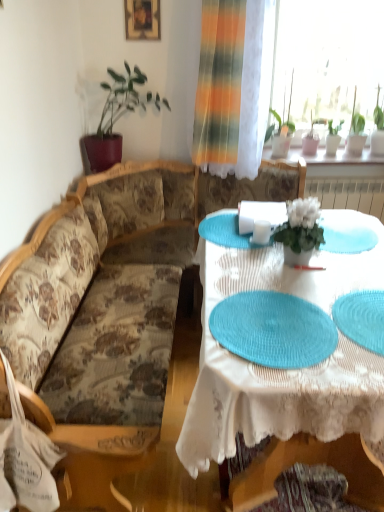
What do you see at coordinates (356, 131) in the screenshot? I see `green leafy plant at upper right, which is the 1th houseplant from right to left` at bounding box center [356, 131].

Locate an element on the screen. This screenshot has width=384, height=512. green leafy plant at upper right, which is the 5th houseplant from left to right is located at coordinates (356, 131).

I want to click on wooden picture frame at upper center, so click(142, 19).

What do you see at coordinates (362, 318) in the screenshot?
I see `blue woven placemat at lower right` at bounding box center [362, 318].

This screenshot has height=512, width=384. I want to click on blue woven placemat at lower right, so click(x=362, y=318).

This screenshot has height=512, width=384. What do you see at coordinates (300, 232) in the screenshot?
I see `white matte flower pot at center, the fourth houseplant positioned from the right` at bounding box center [300, 232].

What is the approximate height of white matte flower pot at center, placed as the first houseplant when sorted from front to back?

The height of white matte flower pot at center, placed as the first houseplant when sorted from front to back, is 10.23 inches.

The width and height of the screenshot is (384, 512). In order to click on teal woven placemat at center in this screenshot , I will do `click(273, 329)`.

Considering the sizes of green matte plant at upper right, arranged as the first houseplant when viewed from the back, and green leafy plant at upper right, which is the 5th houseplant from left to right, in the image, is green matte plant at upper right, arranged as the first houseplant when viewed from the back, bigger or smaller than green leafy plant at upper right, which is the 5th houseplant from left to right,?

In the image, green matte plant at upper right, arranged as the first houseplant when viewed from the back, appears to be smaller than green leafy plant at upper right, which is the 5th houseplant from left to right.

Is green leafy plant at upper right, the second houseplant when ordered from back to front, at the back of green matte plant at upper right, the fourth houseplant viewed from the left?

No.

Which is more to the right, green matte plant at upper right, which appears as the fifth houseplant when viewed from the front, or green leafy plant at upper right, which is the 5th houseplant from left to right?

green leafy plant at upper right, which is the 5th houseplant from left to right, is more to the right.

From a real-world perspective, which is physically below, green matte plant at upper right, the fourth houseplant viewed from the left, or green leafy plant at upper right, which is the 5th houseplant from left to right?

From a 3D spatial view, green matte plant at upper right, the fourth houseplant viewed from the left, is below.

Is green leafy plant at upper right, the 3th houseplant viewed from the right, positioned in front of teal woven placemat at center?

No, green leafy plant at upper right, the 3th houseplant viewed from the right, is further to the viewer.

Locate an element on the screen. the 4th houseplant directly above the teal woven placemat at center (from a real-world perspective) is located at coordinates (281, 129).

Does green leafy plant at upper right, the third houseplant viewed from the back, have a greater height compared to teal woven placemat at center?

Yes.

Is teal woven placemat at center at the back of green leafy plant at upper right, the third houseplant positioned from the left?

green leafy plant at upper right, the third houseplant positioned from the left, is not turned away from teal woven placemat at center.

Based on their sizes in the image, would you say green leafy plant at upper left, the 2th houseplant when ordered from front to back, is bigger or smaller than white lace tablecloth at center?

Considering their sizes, green leafy plant at upper left, the 2th houseplant when ordered from front to back, takes up less space than white lace tablecloth at center.

How different are the orientations of green leafy plant at upper left, placed as the 5th houseplant when sorted from right to left, and white lace tablecloth at center in degrees?

89 degrees separate the facing orientations of green leafy plant at upper left, placed as the 5th houseplant when sorted from right to left, and white lace tablecloth at center.

Is point (135, 67) positioned after point (339, 425)?

Yes.

From the image's perspective, does green leafy plant at upper left, placed as the 5th houseplant when sorted from right to left, appear lower than white lace tablecloth at center?

No.

Is teal woven placemat at center in front of or behind white lace tablecloth at center in the image?

teal woven placemat at center is positioned farther from the viewer than white lace tablecloth at center.

From the image's perspective, is teal woven placemat at center on white lace tablecloth at center?

No, from the image's perspective, teal woven placemat at center is not on top of white lace tablecloth at center.

Is teal woven placemat at center to the left of white lace tablecloth at center from the viewer's perspective?

Yes, teal woven placemat at center is to the left of white lace tablecloth at center.

Based on the photo, considering the sizes of objects teal woven placemat at center and white lace tablecloth at center in the image provided, who is thinner, teal woven placemat at center or white lace tablecloth at center?

With smaller width is teal woven placemat at center.

Based on their sizes in the image, would you say white lace tablecloth at center is bigger or smaller than blue woven placemat at lower right?

Considering their sizes, white lace tablecloth at center takes up more space than blue woven placemat at lower right.

Would you consider white lace tablecloth at center to be distant from blue woven placemat at lower right?

white lace tablecloth at center is actually quite close to blue woven placemat at lower right.

Between white lace tablecloth at center and blue woven placemat at lower right, which one has less height?

blue woven placemat at lower right is shorter.

Which of these two, white lace tablecloth at center or blue woven placemat at lower right, is thinner?

blue woven placemat at lower right.

How different are the orientations of white matte flower pot at center, the fourth houseplant positioned from the right, and teal woven placemat at center in degrees?

The angle between the facing direction of white matte flower pot at center, the fourth houseplant positioned from the right, and the facing direction of teal woven placemat at center is 8.1 degrees.

From a real-world perspective, which object rests below the other?

teal woven placemat at center, from a real-world perspective.

Is white matte flower pot at center, positioned as the 5th houseplant in back-to-front order, positioned behind teal woven placemat at center?

Yes, white matte flower pot at center, positioned as the 5th houseplant in back-to-front order, is further from the viewer.

From their relative heights in the image, would you say floral fabric couch at left is taller or shorter than green matte plant at upper right, which is the second houseplant from right to left?

Considering their sizes, floral fabric couch at left has more height than green matte plant at upper right, which is the second houseplant from right to left.

Considering the sizes of objects floral fabric couch at left and green matte plant at upper right, arranged as the first houseplant when viewed from the back, in the image provided, who is thinner, floral fabric couch at left or green matte plant at upper right, arranged as the first houseplant when viewed from the back,?

With smaller width is green matte plant at upper right, arranged as the first houseplant when viewed from the back.

Is floral fabric couch at left inside the boundaries of green matte plant at upper right, which appears as the fifth houseplant when viewed from the front, or outside?

floral fabric couch at left is not inside green matte plant at upper right, which appears as the fifth houseplant when viewed from the front, it's outside.

Is floral fabric couch at left to the left or to the right of green matte plant at upper right, the fourth houseplant viewed from the left, in the image?

floral fabric couch at left is to the left of green matte plant at upper right, the fourth houseplant viewed from the left.

Identify the location of the 1st houseplant in front of the green matte plant at upper right, arranged as the first houseplant when viewed from the back. (356, 131).

From the image's perspective, which houseplant is the 5th one above the teal woven placemat at center? Please provide its 2D coordinates.

[(281, 129)]

From the image, which object appears to be farther from green leafy plant at upper left, the 4th houseplant when ordered from back to front, green leafy plant at upper right, which ranks as the fourth houseplant in front-to-back order, or floral fabric couch at left?

green leafy plant at upper right, which ranks as the fourth houseplant in front-to-back order, lies further to green leafy plant at upper left, the 4th houseplant when ordered from back to front, than the other object.

Estimate the real-world distances between objects in this image. Which object is closer to teal woven placemat at center, green leafy plant at upper left, placed as the 5th houseplant when sorted from right to left, or green matte plant at upper right, which appears as the fifth houseplant when viewed from the front?

The object closer to teal woven placemat at center is green leafy plant at upper left, placed as the 5th houseplant when sorted from right to left.

Looking at this image, estimate the real-world distances between objects in this image. Which object is closer to white lace tablecloth at center, floral fabric couch at left or teal woven placemat at center?

teal woven placemat at center lies closer to white lace tablecloth at center than the other object.

Based on the photo, from the image, which object appears to be nearer to green matte plant at upper right, the fourth houseplant viewed from the left, green leafy plant at upper right, which is the 1th houseplant from right to left, or teal woven placemat at center?

Among the two, green leafy plant at upper right, which is the 1th houseplant from right to left, is located nearer to green matte plant at upper right, the fourth houseplant viewed from the left.

Estimate the real-world distances between objects in this image. Which object is further from white lace tablecloth at center, green leafy plant at upper right, the third houseplant viewed from the back, or blue woven placemat at lower right?

green leafy plant at upper right, the third houseplant viewed from the back.

Looking at the image, which one is located further to white lace tablecloth at center, teal woven placemat at center or floral fabric couch at left?

floral fabric couch at left.

Considering their positions, is green matte plant at upper right, which appears as the fifth houseplant when viewed from the front, positioned further to green leafy plant at upper left, the first houseplant in the left-to-right sequence, than floral fabric couch at left?

green matte plant at upper right, which appears as the fifth houseplant when viewed from the front, lies further to green leafy plant at upper left, the first houseplant in the left-to-right sequence, than the other object.

Looking at the image, which one is located closer to white lace tablecloth at center, green leafy plant at upper left, the 2th houseplant when ordered from front to back, or green matte plant at upper right, arranged as the first houseplant when viewed from the back?

green leafy plant at upper left, the 2th houseplant when ordered from front to back, lies closer to white lace tablecloth at center than the other object.

Where is `platter positioned between teal woven placemat at center and green leafy plant at upper right, which ranks as the fourth houseplant in front-to-back order, from near to far`? This screenshot has height=512, width=384. platter positioned between teal woven placemat at center and green leafy plant at upper right, which ranks as the fourth houseplant in front-to-back order, from near to far is located at coordinates (362, 318).

The image size is (384, 512). Identify the location of platter between teal woven placemat at center and green leafy plant at upper right, which ranks as the 3th houseplant in front-to-back order, along the z-axis. (362, 318).

Image resolution: width=384 pixels, height=512 pixels. Identify the location of houseplant between white lace tablecloth at center and green leafy plant at upper left, the 2th houseplant when ordered from front to back, along the z-axis. (300, 232).

Locate an element on the screen. The height and width of the screenshot is (512, 384). studio couch positioned between white lace tablecloth at center and green matte plant at upper right, which appears as the fifth houseplant when viewed from the front, from near to far is located at coordinates tap(100, 319).